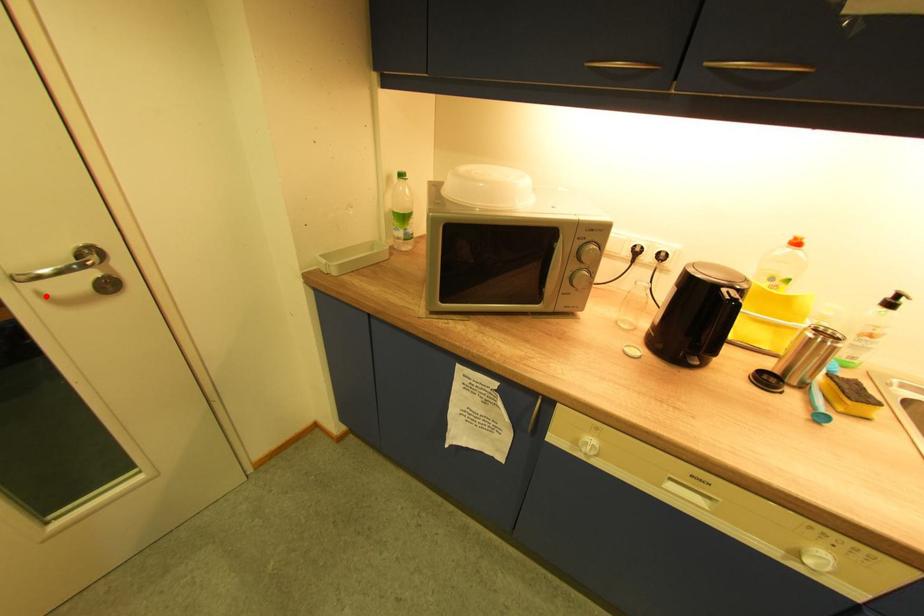
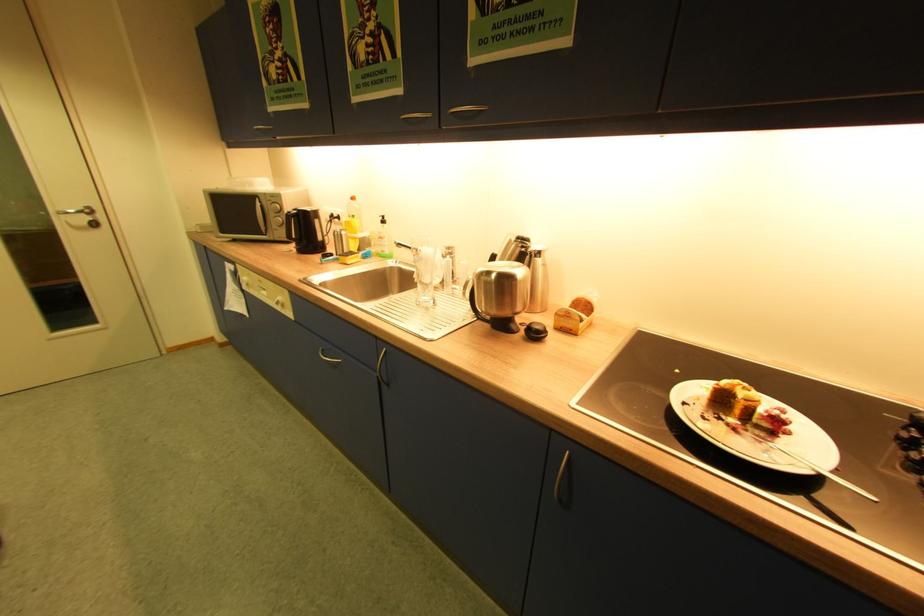
The point at the highlighted location is marked in the first image. Where is the corresponding point in the second image?

(74, 224)